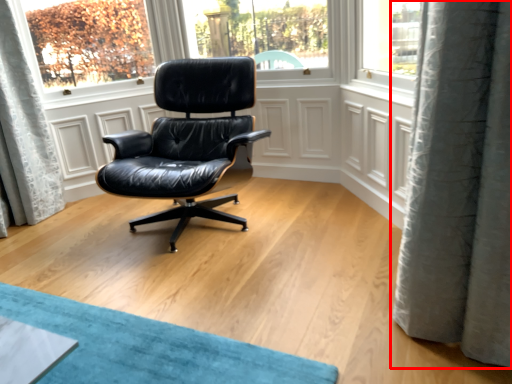
Question: From the image's perspective, considering the relative positions of curtain (annotated by the red box) and chair in the image provided, where is curtain (annotated by the red box) located with respect to the staircase?

Choices:
 (A) below
 (B) above

Answer: (A)